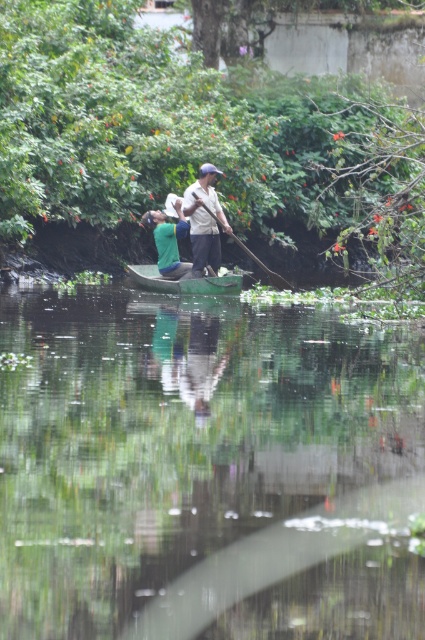
Question: Which of the following is the farthest from the observer?

Choices:
 (A) (207, 552)
 (B) (286, 282)

Answer: (B)

Question: Which object is the closest to the green plastic boat at center?

Choices:
 (A) light brown wooden paddle at center
 (B) green fabric shirt at center

Answer: (B)

Question: Is green matte canoe at center bigger than wooden smooth paddle at center?

Choices:
 (A) no
 (B) yes

Answer: (B)

Question: Estimate the real-world distances between objects in this image. Which object is farther from the green matte canoe at center?

Choices:
 (A) green fabric shirt at center
 (B) light brown wooden paddle at center
 (C) wooden smooth paddle at center
 (D) green plastic boat at center

Answer: (D)

Question: Does green plastic boat at center have a greater width compared to green matte canoe at center?

Choices:
 (A) yes
 (B) no

Answer: (A)

Question: Is green plastic boat at center bigger than green fabric shirt at center?

Choices:
 (A) yes
 (B) no

Answer: (A)